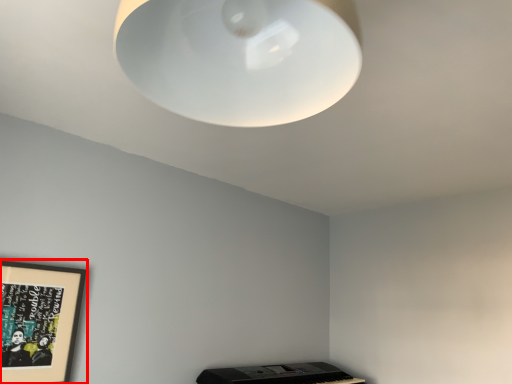
Question: From the image's perspective, what is the correct spatial relationship of picture frame (annotated by the red box) in relation to lamp?

Choices:
 (A) above
 (B) below

Answer: (B)